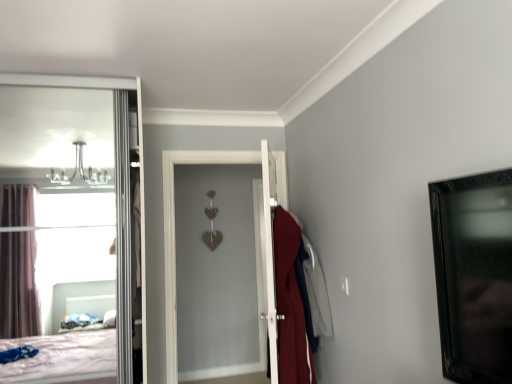
Question: From the image's perspective, would you say black glossy picture frame at right is shown under velvet red robe at center?

Choices:
 (A) no
 (B) yes

Answer: (A)

Question: Is black glossy picture frame at right wider than velvet red robe at center?

Choices:
 (A) no
 (B) yes

Answer: (A)

Question: Are black glossy picture frame at right and velvet red robe at center located far from each other?

Choices:
 (A) no
 (B) yes

Answer: (B)

Question: From a real-world perspective, does black glossy picture frame at right sit lower than velvet red robe at center?

Choices:
 (A) no
 (B) yes

Answer: (A)

Question: Considering the relative positions of black glossy picture frame at right and velvet red robe at center in the image provided, is black glossy picture frame at right to the left of velvet red robe at center from the viewer's perspective?

Choices:
 (A) yes
 (B) no

Answer: (B)

Question: Is velvet red robe at center located within black glossy picture frame at right?

Choices:
 (A) no
 (B) yes

Answer: (A)

Question: Is velvet red robe at center in front of black glossy picture frame at right?

Choices:
 (A) yes
 (B) no

Answer: (B)

Question: Are velvet red robe at center and black glossy picture frame at right located far from each other?

Choices:
 (A) no
 (B) yes

Answer: (B)

Question: Can you confirm if velvet red robe at center is positioned to the left of black glossy picture frame at right?

Choices:
 (A) yes
 (B) no

Answer: (A)

Question: Is velvet red robe at center facing away from black glossy picture frame at right?

Choices:
 (A) no
 (B) yes

Answer: (A)

Question: Considering the relative sizes of velvet red robe at center and black glossy picture frame at right in the image provided, is velvet red robe at center wider than black glossy picture frame at right?

Choices:
 (A) yes
 (B) no

Answer: (A)

Question: Does velvet red robe at center have a smaller size compared to black glossy picture frame at right?

Choices:
 (A) no
 (B) yes

Answer: (A)

Question: From the image's perspective, is velvet red robe at center located above or below black glossy picture frame at right?

Choices:
 (A) below
 (B) above

Answer: (A)